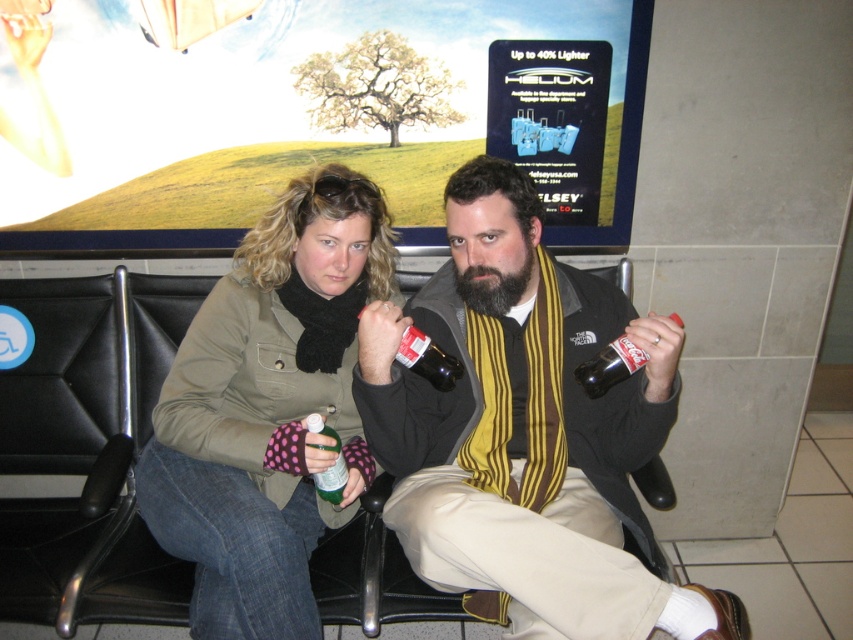
Measure the distance between dark glass bottle at center and camera.

The distance of dark glass bottle at center from camera is 4.64 feet.

Which of these two, dark glass bottle at center or matte glass bottle at right, stands shorter?

With less height is matte glass bottle at right.

Is point (392, 339) less distant than point (589, 380)?

No, it is behind (589, 380).

Locate an element on the screen. This screenshot has width=853, height=640. dark glass bottle at center is located at coordinates (399, 348).

Who is shorter, matte green jacket at center or green glass bottle at center?

With less height is green glass bottle at center.

Describe the element at coordinates (268, 408) in the screenshot. I see `matte green jacket at center` at that location.

At what (x,y) coordinates should I click in order to perform the action: click on matte green jacket at center. Please return your answer as a coordinate pair (x, y). Image resolution: width=853 pixels, height=640 pixels. Looking at the image, I should click on (268, 408).

Which is in front, point (437, 584) or point (310, 417)?

Point (437, 584)

Measure the distance between point (601, 620) and camera.

4.03 feet

Is point (512, 577) positioned in front of point (332, 499)?

Yes, point (512, 577) is in front of point (332, 499).

Image resolution: width=853 pixels, height=640 pixels. In order to click on matte black jacket at center in this screenshot , I will do `click(527, 433)`.